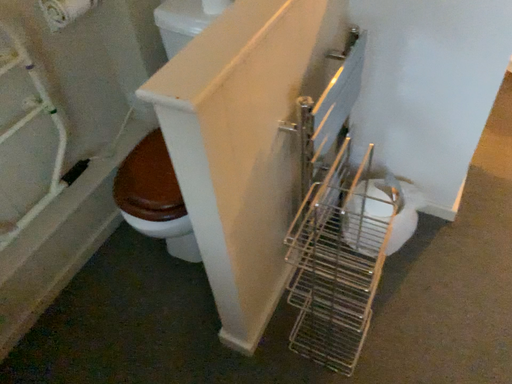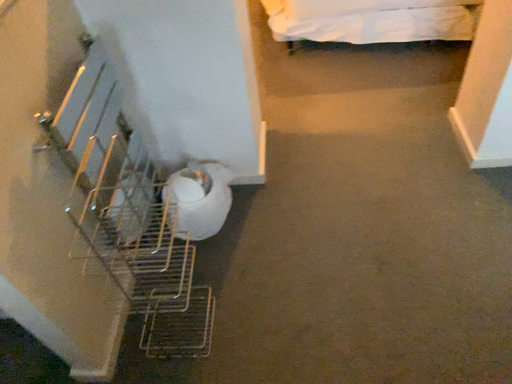
Question: Which way did the camera rotate in the video?

Choices:
 (A) rotated right
 (B) rotated left

Answer: (A)